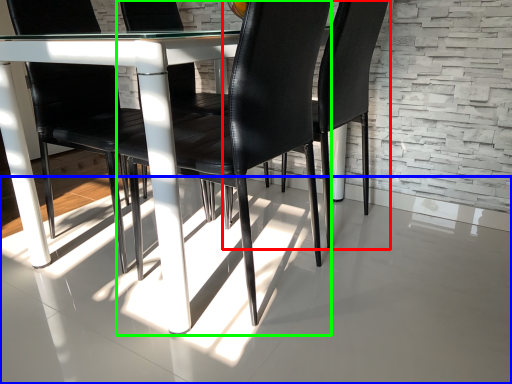
Question: Based on their relative distances, which object is nearer to chair (highlighted by a red box)? Choose from concrete (highlighted by a blue box) and chair (highlighted by a green box).

Choices:
 (A) concrete
 (B) chair

Answer: (B)